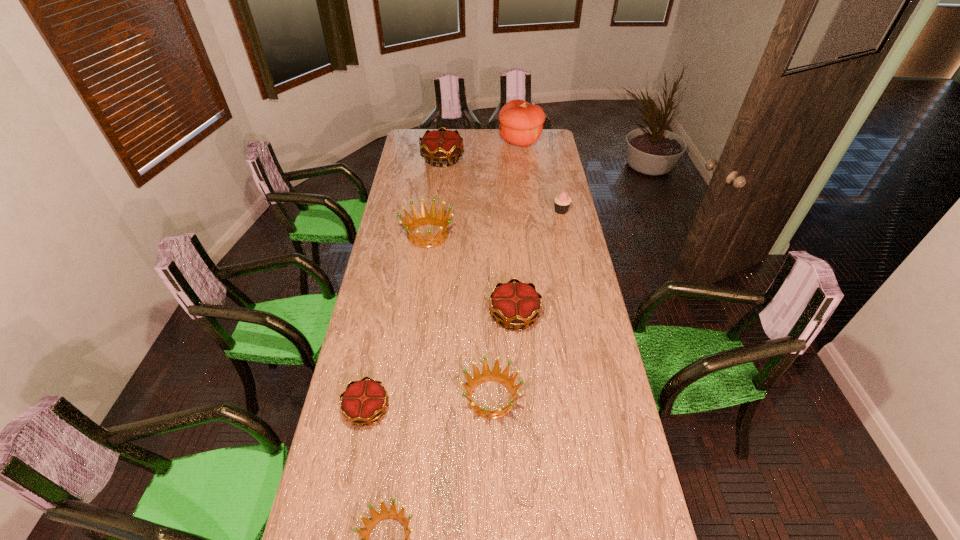
Identify the location of the rightmost golden crown. (503, 378).

You are a GUI agent. You are given a task and a screenshot of the screen. Output one action in this format:
    pyautogui.click(x=<x>, y=<y>)
    Task: Click on the smallest gold crown
    
    Given the screenshot: What is the action you would take?
    pyautogui.click(x=364, y=401)

Where is `vacant space situated on the front of the pumpkin`? vacant space situated on the front of the pumpkin is located at coordinates (525, 177).

Locate an element on the screen. This screenshot has height=540, width=960. vacant point located 0.390m on the right of the farthest gold crown is located at coordinates (532, 159).

Image resolution: width=960 pixels, height=540 pixels. Find the location of `vacant space located 0.170m on the front of the fourth farthest object`. vacant space located 0.170m on the front of the fourth farthest object is located at coordinates (422, 280).

Locate an element on the screen. The image size is (960, 540). blank space located on the front of the sixth nearest object is located at coordinates (564, 222).

Locate an element on the screen. The image size is (960, 540). free space located on the left of the third farthest crown is located at coordinates point(424,315).

The width and height of the screenshot is (960, 540). What are the coordinates of `free region located 0.240m on the front of the second biggest golden crown` in the screenshot? It's located at [493, 508].

Locate an element on the screen. This screenshot has width=960, height=540. vacant space located 0.360m on the right of the smallest gold crown is located at coordinates (500, 409).

Identify the location of pumpkin that is at the far edge. Image resolution: width=960 pixels, height=540 pixels. (521, 123).